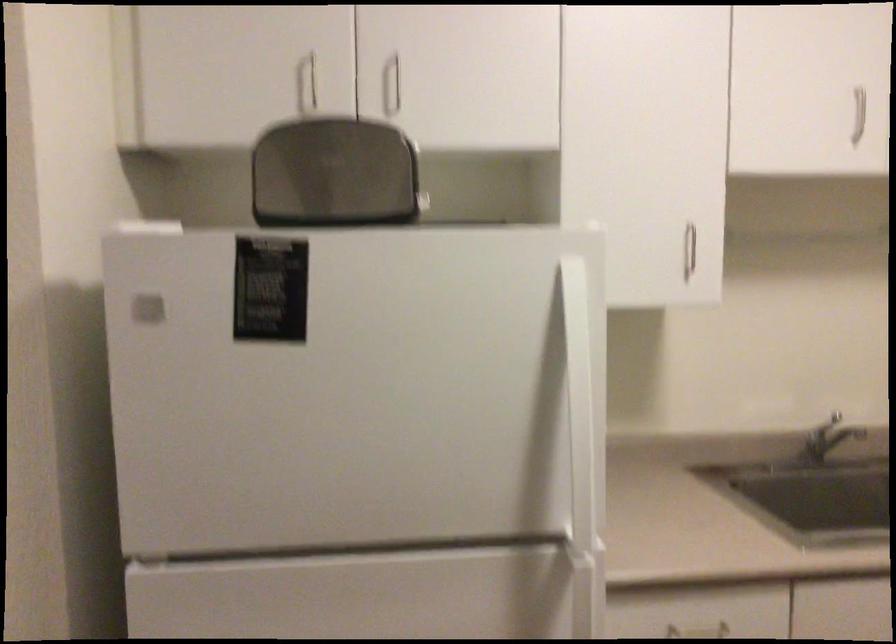
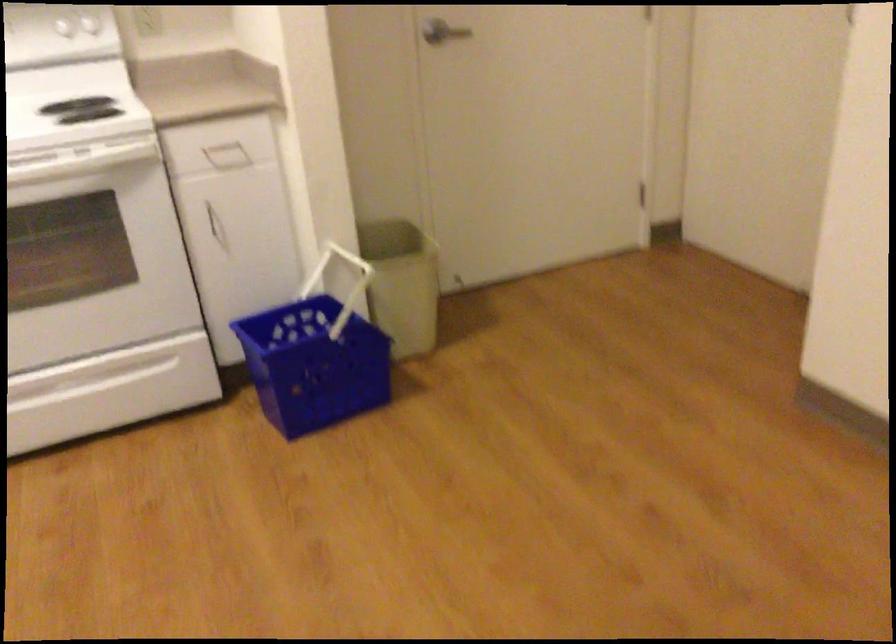
In the scene shown: Based on the continuous images, in which direction is the camera rotating?

The camera's rotation is toward right-down.